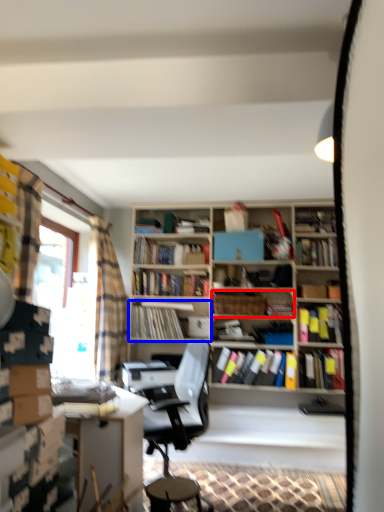
Question: Which object appears closest to the camera in this image, book (highlighted by a red box) or book (highlighted by a blue box)?

Choices:
 (A) book
 (B) book

Answer: (A)